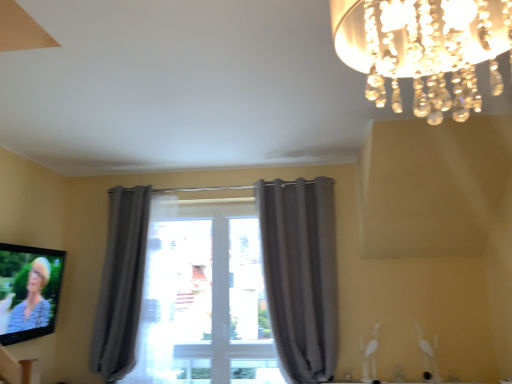
Question: Is the depth of gray fabric curtain at center, which is the 2th curtain in left-to-right order, greater than that of clear crystal chandelier at upper right?

Choices:
 (A) yes
 (B) no

Answer: (A)

Question: Is gray fabric curtain at center, the first curtain viewed from the right, placed right next to clear crystal chandelier at upper right?

Choices:
 (A) no
 (B) yes

Answer: (A)

Question: Does gray fabric curtain at center, which is the 2th curtain in left-to-right order, have a larger size compared to clear crystal chandelier at upper right?

Choices:
 (A) yes
 (B) no

Answer: (A)

Question: Considering the relative sizes of gray fabric curtain at center, the first curtain viewed from the right, and clear crystal chandelier at upper right in the image provided, is gray fabric curtain at center, the first curtain viewed from the right, taller than clear crystal chandelier at upper right?

Choices:
 (A) no
 (B) yes

Answer: (B)

Question: Is gray fabric curtain at center, the first curtain viewed from the right, thinner than clear crystal chandelier at upper right?

Choices:
 (A) yes
 (B) no

Answer: (A)

Question: From the image's perspective, would you say gray fabric curtain at center, the first curtain viewed from the right, is shown under clear crystal chandelier at upper right?

Choices:
 (A) yes
 (B) no

Answer: (A)

Question: Does gray fabric curtain at center, the first curtain viewed from the right, have a larger size compared to gray fabric curtain at left, the second curtain viewed from the right?

Choices:
 (A) yes
 (B) no

Answer: (A)

Question: Is gray fabric curtain at center, the first curtain viewed from the right, further to the viewer compared to gray fabric curtain at left, positioned as the 1th curtain in left-to-right order?

Choices:
 (A) yes
 (B) no

Answer: (B)

Question: Does gray fabric curtain at center, which is the 2th curtain in left-to-right order, lie in front of gray fabric curtain at left, positioned as the 1th curtain in left-to-right order?

Choices:
 (A) no
 (B) yes

Answer: (B)

Question: Is gray fabric curtain at center, the first curtain viewed from the right, wider than gray fabric curtain at left, positioned as the 1th curtain in left-to-right order?

Choices:
 (A) yes
 (B) no

Answer: (B)

Question: Does gray fabric curtain at center, the first curtain viewed from the right, appear on the left side of gray fabric curtain at left, positioned as the 1th curtain in left-to-right order?

Choices:
 (A) no
 (B) yes

Answer: (A)

Question: Is gray fabric curtain at center, which is the 2th curtain in left-to-right order, oriented away from gray fabric curtain at left, positioned as the 1th curtain in left-to-right order?

Choices:
 (A) no
 (B) yes

Answer: (A)

Question: Can you confirm if matte black tv at lower left is wider than gray fabric curtain at center, the first curtain viewed from the right?

Choices:
 (A) no
 (B) yes

Answer: (A)